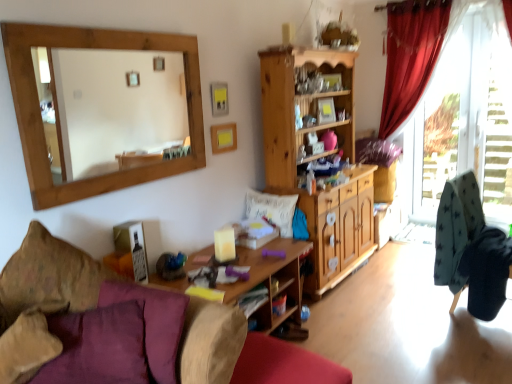
Find the location of a particular element. This screenshot has width=512, height=384. velvet purple cushion at lower left, the first pillow when ordered from front to back is located at coordinates (28, 344).

Image resolution: width=512 pixels, height=384 pixels. What do you see at coordinates (318, 158) in the screenshot? I see `wooden cabinet at center` at bounding box center [318, 158].

This screenshot has width=512, height=384. Find the location of `wooden mirror at upper left`. wooden mirror at upper left is located at coordinates (110, 108).

Does velvet purple cushion at lower left have a larger size compared to wooden picture frame at upper center?

Correct, velvet purple cushion at lower left is larger in size than wooden picture frame at upper center.

Is there a large distance between velvet purple cushion at lower left and wooden picture frame at upper center?

That's right, there is a large distance between velvet purple cushion at lower left and wooden picture frame at upper center.

Looking at this image, is velvet purple cushion at lower left outside of wooden picture frame at upper center?

Indeed, velvet purple cushion at lower left is completely outside wooden picture frame at upper center.

From a real-world perspective, is velvet purple cushion at lower left located higher than wooden picture frame at upper center?

No, from a real-world perspective, velvet purple cushion at lower left is not on top of wooden picture frame at upper center.

Considering the sizes of objects white soft cushion at center, placed as the third pillow when sorted from front to back, and red velvet curtain at right in the image provided, who is wider, white soft cushion at center, placed as the third pillow when sorted from front to back, or red velvet curtain at right?

Wider between the two is white soft cushion at center, placed as the third pillow when sorted from front to back.

Which is closer, (x=269, y=220) or (x=389, y=20)?

Point (x=269, y=220)

Can you confirm if white soft cushion at center, placed as the third pillow when sorted from front to back, is bigger than red velvet curtain at right?

Incorrect, white soft cushion at center, placed as the third pillow when sorted from front to back, is not larger than red velvet curtain at right.

Which is correct: white soft cushion at center, the first pillow viewed from the back, is inside red velvet curtain at right, or outside of it?

The correct answer is: outside.

How much distance is there between white soft cushion at center, placed as the third pillow when sorted from front to back, and teal fabric rocking chair at right?

white soft cushion at center, placed as the third pillow when sorted from front to back, and teal fabric rocking chair at right are 1.13 meters apart from each other.

Looking at the image, does white soft cushion at center, placed as the third pillow when sorted from front to back, seem bigger or smaller compared to teal fabric rocking chair at right?

Clearly, white soft cushion at center, placed as the third pillow when sorted from front to back, is smaller in size than teal fabric rocking chair at right.

Is white soft cushion at center, placed as the third pillow when sorted from front to back, wider or thinner than teal fabric rocking chair at right?

In the image, white soft cushion at center, placed as the third pillow when sorted from front to back, appears to be more narrow than teal fabric rocking chair at right.

From a real-world perspective, is white soft cushion at center, arranged as the first pillow when viewed from the right, located beneath teal fabric rocking chair at right?

Actually, white soft cushion at center, arranged as the first pillow when viewed from the right, is physically above teal fabric rocking chair at right in the real world.

Is wooden mirror at upper left far from velvet purple cushion at lower left?

That's right, there is a large distance between wooden mirror at upper left and velvet purple cushion at lower left.

Is wooden mirror at upper left turned away from velvet purple cushion at lower left?

No, velvet purple cushion at lower left is not at the back of wooden mirror at upper left.

Which point is more forward, [145,81] or [284,363]?

Point [284,363]

Considering the sizes of objects white soft cushion at center, placed as the third pillow when sorted from front to back, and velvet purple cushion at lower left, which is the second pillow from left to right, in the image provided, who is wider, white soft cushion at center, placed as the third pillow when sorted from front to back, or velvet purple cushion at lower left, which is the second pillow from left to right,?

With larger width is velvet purple cushion at lower left, which is the second pillow from left to right.

Can you tell me how much white soft cushion at center, arranged as the first pillow when viewed from the right, and velvet purple cushion at lower left, the first pillow when ordered from front to back, differ in facing direction?

The angle between the facing direction of white soft cushion at center, arranged as the first pillow when viewed from the right, and the facing direction of velvet purple cushion at lower left, the first pillow when ordered from front to back, is 80.4 degrees.

Could you tell me if white soft cushion at center, the first pillow viewed from the back, is facing velvet purple cushion at lower left, positioned as the second pillow in right-to-left order?

Yes, white soft cushion at center, the first pillow viewed from the back, faces towards velvet purple cushion at lower left, positioned as the second pillow in right-to-left order.

At what (x,y) coordinates should I click in order to perform the action: click on picture frame located behind the velvet purple pillow at lower left, marked as the 2th pillow in a back-to-front arrangement. Please return your answer as a coordinate pair (x, y). The height and width of the screenshot is (384, 512). Looking at the image, I should click on (223, 138).

Does wooden picture frame at upper center have a greater height compared to velvet purple pillow at lower left, arranged as the second pillow when viewed from the front?

In fact, wooden picture frame at upper center may be shorter than velvet purple pillow at lower left, arranged as the second pillow when viewed from the front.

From a real-world perspective, which object rests below the other?

velvet purple pillow at lower left, marked as the 2th pillow in a back-to-front arrangement, is physically lower.

Is woodenmaterial/texturetable at center spatially inside wooden mirror at upper left, or outside of it?

woodenmaterial/texturetable at center lies outside wooden mirror at upper left.

How different are the orientations of woodenmaterial/texturetable at center and wooden mirror at upper left in degrees?

There is a 0.98-degree angle between the facing directions of woodenmaterial/texturetable at center and wooden mirror at upper left.

From a real-world perspective, which is physically below, woodenmaterial/texturetable at center or wooden mirror at upper left?

woodenmaterial/texturetable at center is physically lower.

How distant is woodenmaterial/texturetable at center from wooden mirror at upper left?

They are 2.40 meters apart.

Find the location of a particular element. This screenshot has width=512, height=384. picture frame behind the velvet purple cushion at lower left is located at coordinates (223, 138).

Locate an element on the screen. Image resolution: width=512 pixels, height=384 pixels. curtain on the right of white soft cushion at center, placed as the third pillow when sorted from front to back is located at coordinates point(410,56).

From the image, which object appears to be nearer to velvet purple cushion at lower left, the first pillow when ordered from front to back, velvet purple pillow at lower left, arranged as the second pillow when viewed from the front, or transparent glass door at right?

The object closer to velvet purple cushion at lower left, the first pillow when ordered from front to back, is velvet purple pillow at lower left, arranged as the second pillow when viewed from the front.

Based on their spatial positions, is wooden picture frame at upper center or wooden mirror at upper left closer to wooden cabinet at center?

wooden picture frame at upper center.

Looking at the image, which one is located closer to wooden mirror at upper left, white soft cushion at center, placed as the third pillow when sorted from front to back, or red velvet curtain at right?

white soft cushion at center, placed as the third pillow when sorted from front to back.

When comparing their distances from teal fabric rocking chair at right, does wooden picture frame at upper center or velvet purple cushion at lower left, which is the second pillow from left to right, seem further?

velvet purple cushion at lower left, which is the second pillow from left to right, lies further to teal fabric rocking chair at right than the other object.

Based on their spatial positions, is wooden picture frame at upper center or red velvet curtain at right closer to teal fabric rocking chair at right?

wooden picture frame at upper center is closer to teal fabric rocking chair at right.

From the image, which object appears to be farther from wooden picture frame at upper center, wooden cabinet at center or white soft cushion at center, arranged as the first pillow when viewed from the right?

wooden cabinet at center is further to wooden picture frame at upper center.

Looking at the image, which one is located further to red velvet curtain at right, velvet purple cushion at lower left or white soft cushion at center, the first pillow viewed from the back?

velvet purple cushion at lower left.

From the image, which object appears to be nearer to transparent glass door at right, wooden cabinet at center or teal fabric rocking chair at right?

Based on the image, wooden cabinet at center appears to be nearer to transparent glass door at right.

Locate an element on the screen. This screenshot has height=384, width=512. table located between velvet purple cushion at lower left and teal fabric rocking chair at right in the left-right direction is located at coordinates (271, 285).

Find the location of a particular element. picture frame between wooden mirror at upper left and woodenmaterial/texturetable at center vertically is located at coordinates (223, 138).

Image resolution: width=512 pixels, height=384 pixels. In order to click on pillow located between velvet purple cushion at lower left, the first pillow when ordered from front to back, and woodenmaterial/texturetable at center in the depth direction in this screenshot , I will do `click(49, 276)`.

Where is `rocking chair located between woodenmaterial/texturetable at center and red velvet curtain at right in the left-right direction`? Image resolution: width=512 pixels, height=384 pixels. rocking chair located between woodenmaterial/texturetable at center and red velvet curtain at right in the left-right direction is located at coordinates (471, 249).